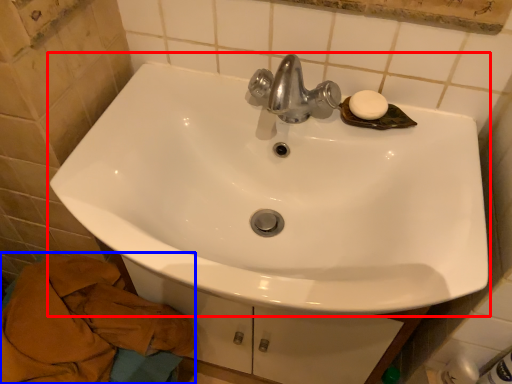
Question: Which object is closer to the camera taking this photo, sink (highlighted by a red box) or bath towel (highlighted by a blue box)?

Choices:
 (A) sink
 (B) bath towel

Answer: (A)